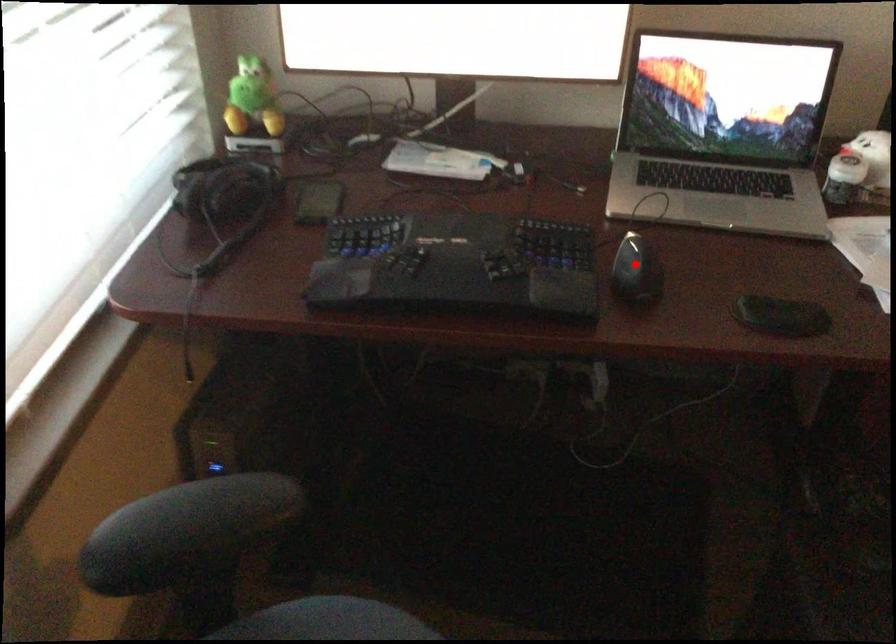
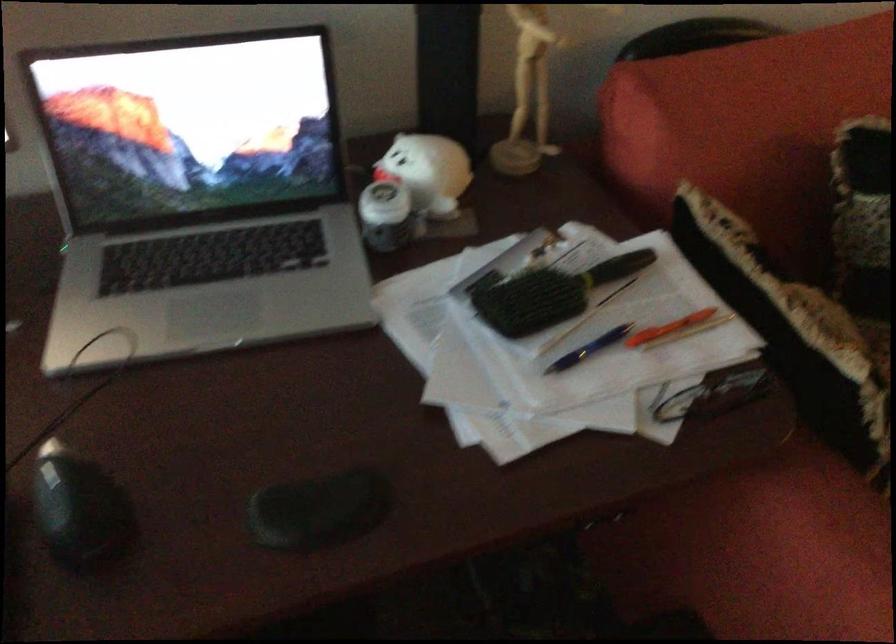
In the second image, find the point that corresponds to the highlighted location in the first image.

(80, 511)